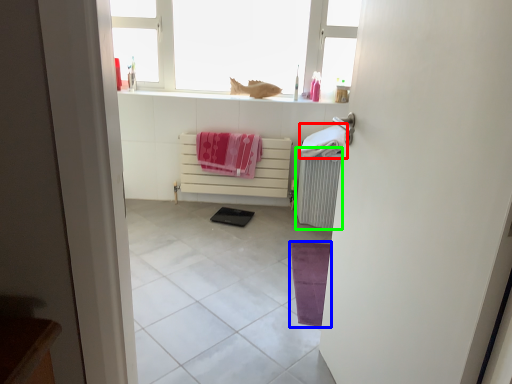
Question: Which is nearer to the beach towel (highlighted by a red box)? yoga mat (highlighted by a blue box) or radiator (highlighted by a green box).

Choices:
 (A) yoga mat
 (B) radiator

Answer: (B)